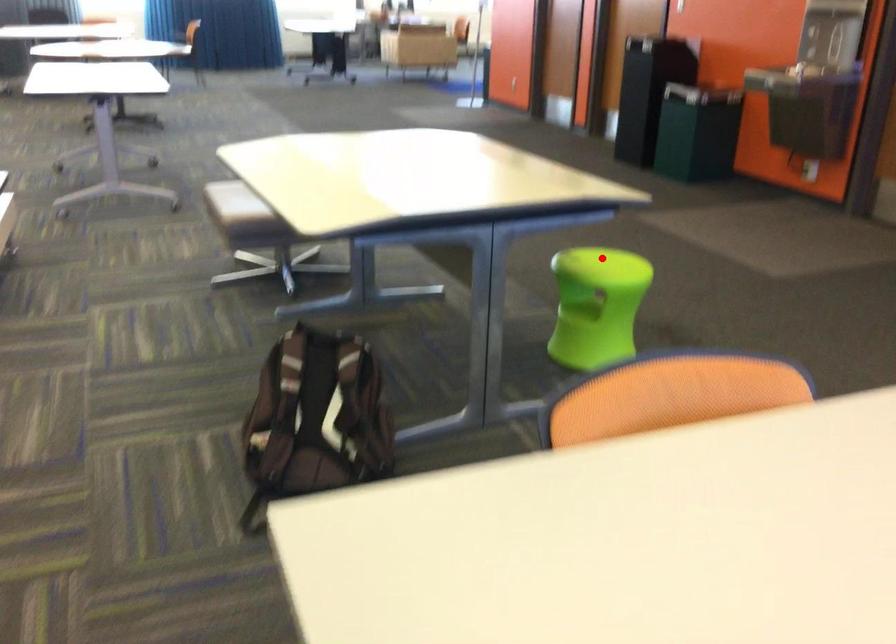
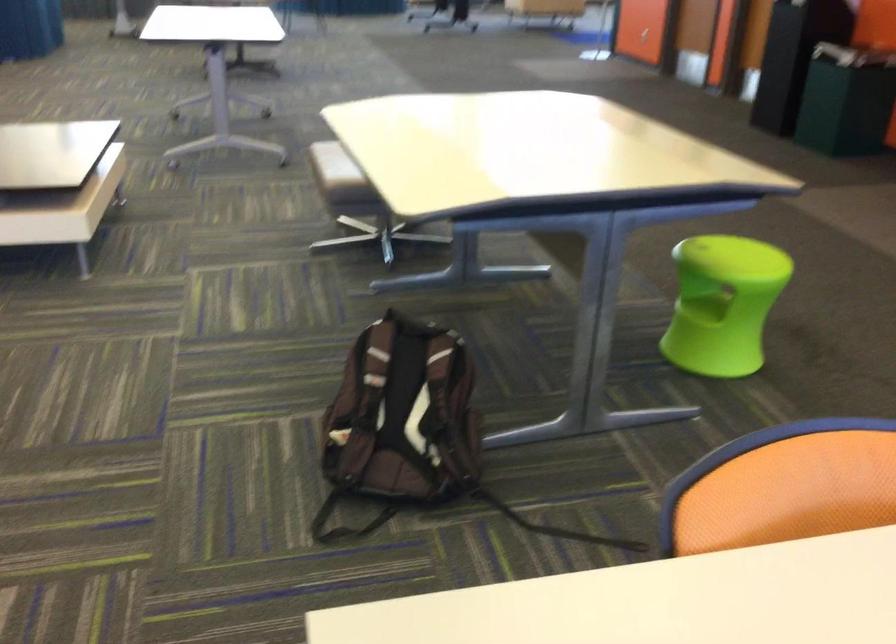
Question: I am providing you with two images of the same scene from different viewpoints. In image1, a red point is highlighted. Considering the same 3D point in image2, which of the following is correct?

Choices:
 (A) It is closer
 (B) It is farther

Answer: (A)